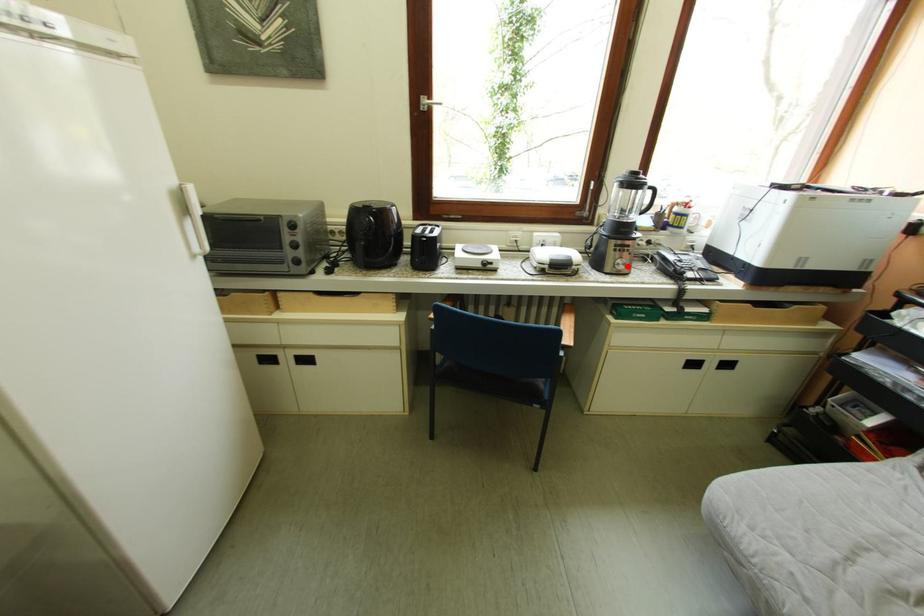
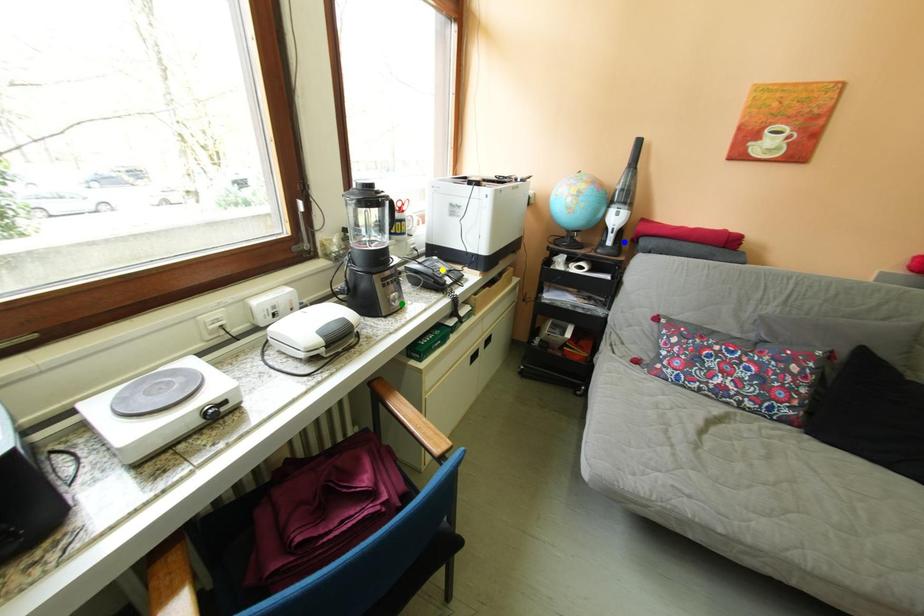
Question: I am providing you with two images of the same scene from different viewpoints. A red point is marked on the first image. You are given multiple points on the second image. Which point in image 2 is actually the same real-world point as the red point in image 1?

Choices:
 (A) yellow point
 (B) blue point
 (C) green point

Answer: (C)